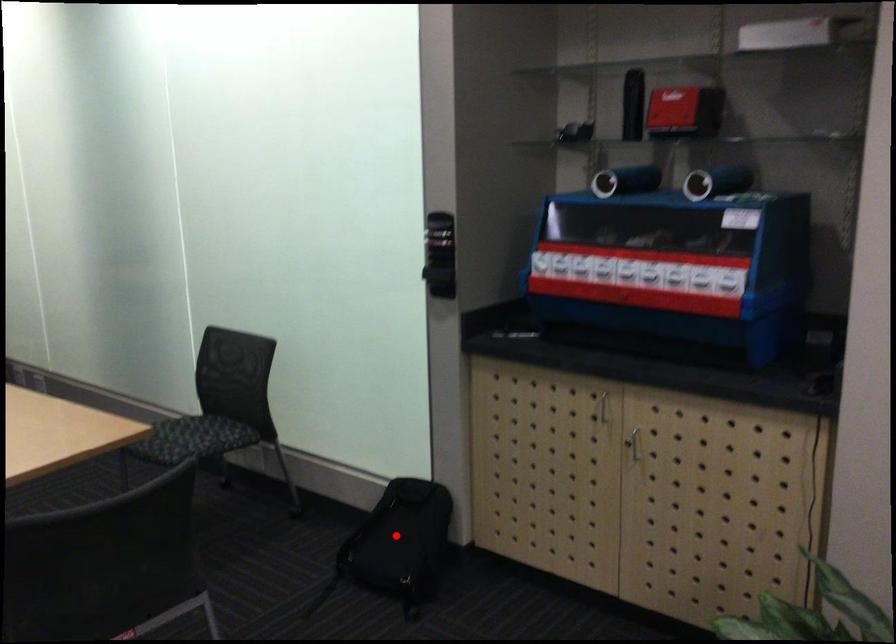
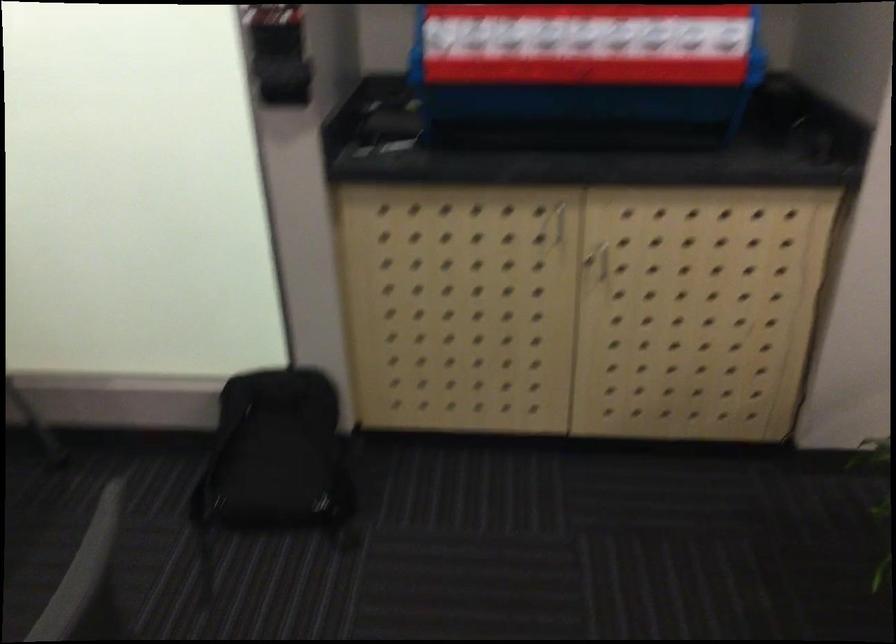
Locate, in the second image, the point that corresponds to the highlighted location in the first image.

(277, 455)